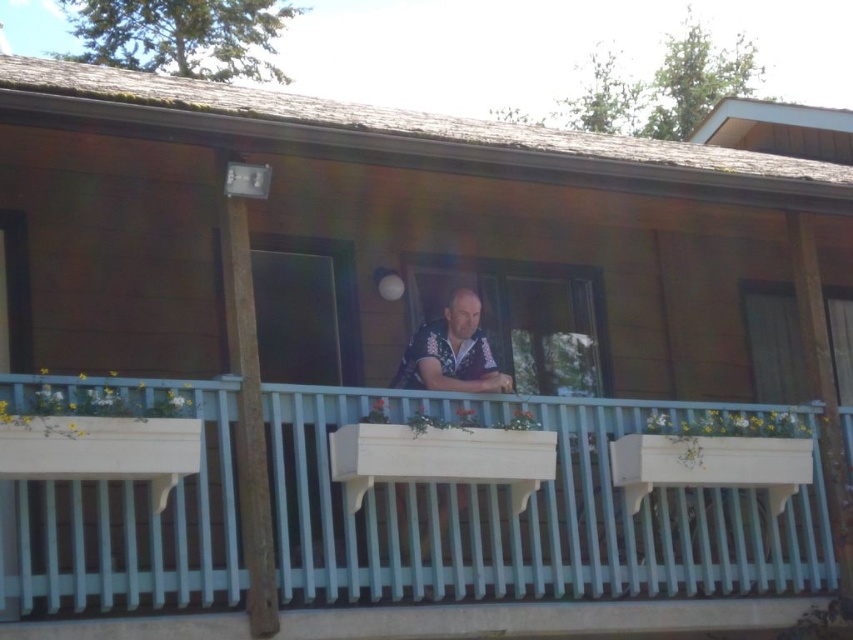
Question: Does white painted wood porch at center lie behind matte black window at center?

Choices:
 (A) no
 (B) yes

Answer: (A)

Question: From the image, what is the correct spatial relationship of white painted wood porch at center in relation to matte black window at center?

Choices:
 (A) left
 (B) right

Answer: (B)

Question: Which point appears farthest from the camera in this image?

Choices:
 (A) (32, 500)
 (B) (506, 307)

Answer: (B)

Question: Which of the following is the farthest from the observer?

Choices:
 (A) matte black window at center
 (B) white painted wood porch at center

Answer: (A)

Question: Is white painted wood porch at center positioned behind matte black window at center?

Choices:
 (A) yes
 (B) no

Answer: (B)

Question: Which point appears farthest from the camera in this image?

Choices:
 (A) (409, 300)
 (B) (744, 540)

Answer: (B)